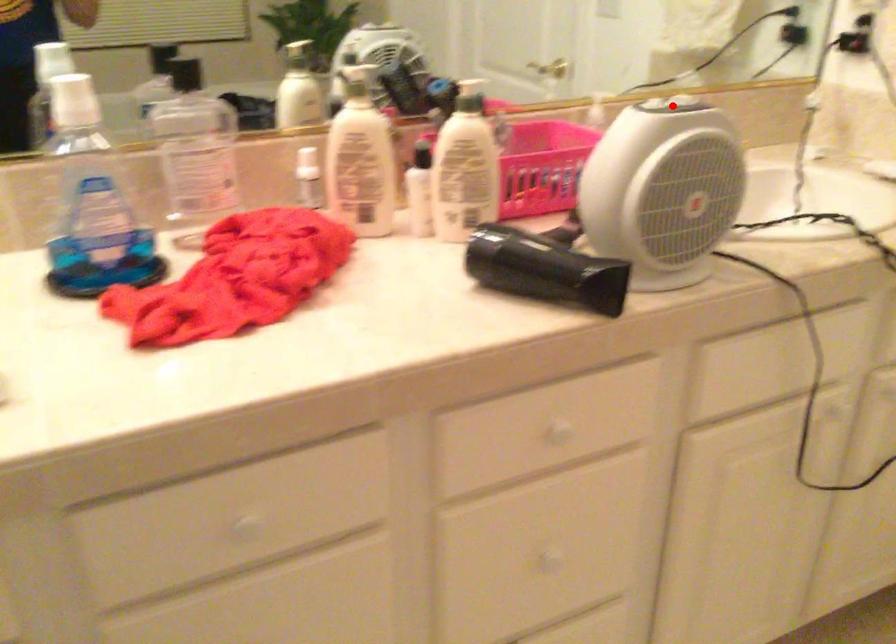
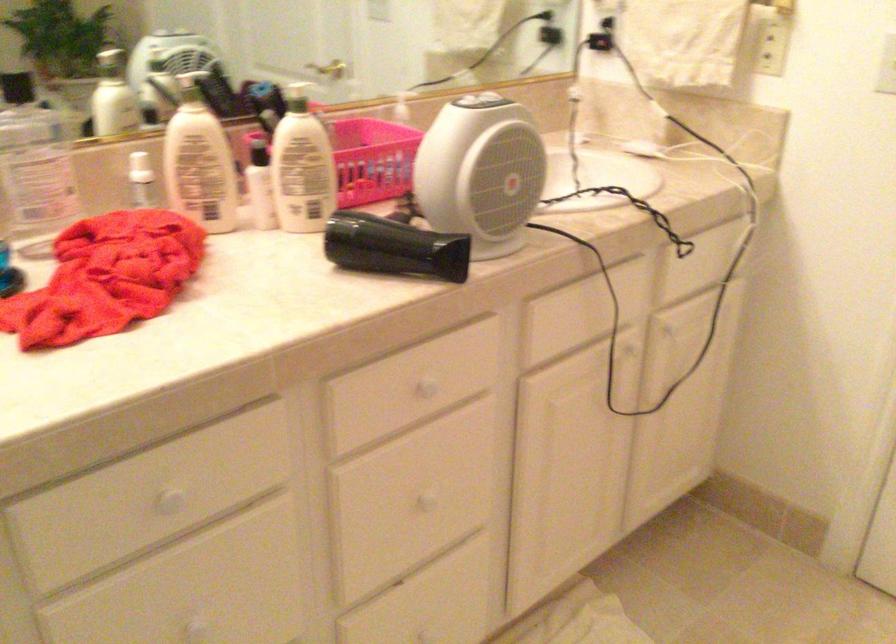
In the second image, find the point that corresponds to the highlighted location in the first image.

(484, 102)